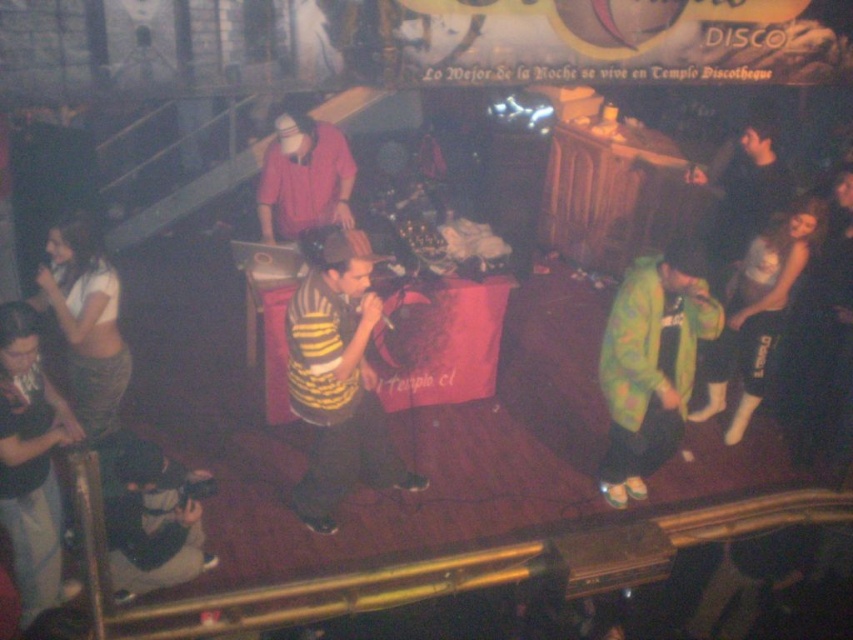
Between white fabric skirt at lower left and matte pink shirt at center, which one appears on the left side from the viewer's perspective?

white fabric skirt at lower left

Between point (94, 243) and point (312, 164), which one is positioned in front?

Point (94, 243) is in front.

This screenshot has width=853, height=640. Find the location of `white fabric skirt at lower left`. white fabric skirt at lower left is located at coordinates tap(86, 323).

Who is shorter, yellow striped shirt at center or matte pink shirt at center?

Standing shorter between the two is matte pink shirt at center.

Is yellow striped shirt at center to the right of matte pink shirt at center from the viewer's perspective?

Yes, yellow striped shirt at center is to the right of matte pink shirt at center.

Is point (302, 282) positioned in front of point (276, 120)?

Yes, point (302, 282) is closer to viewer.

You are a GUI agent. You are given a task and a screenshot of the screen. Output one action in this format:
    pyautogui.click(x=<x>, y=<y>)
    Task: Click on the yellow striped shirt at center
    The image size is (853, 640).
    Given the screenshot: What is the action you would take?
    pyautogui.click(x=338, y=378)

Does yellow striped shirt at center appear on the right side of white fabric skirt at lower left?

Yes, yellow striped shirt at center is to the right of white fabric skirt at lower left.

Does yellow striped shirt at center have a larger size compared to white fabric skirt at lower left?

Indeed, yellow striped shirt at center has a larger size compared to white fabric skirt at lower left.

Between point (346, 337) and point (67, 349), which one is positioned in front?

Point (346, 337) is more forward.

Where is `yellow striped shirt at center`? This screenshot has height=640, width=853. yellow striped shirt at center is located at coordinates (338, 378).